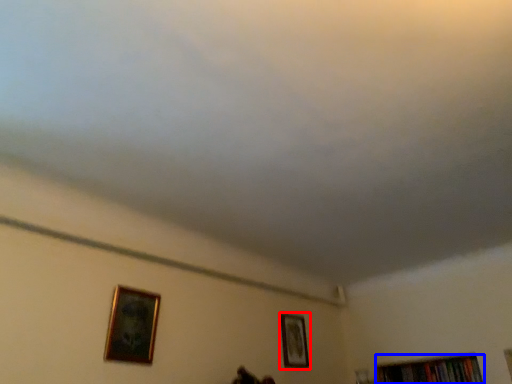
Question: Which object is further to the camera taking this photo, picture frame (highlighted by a red box) or book (highlighted by a blue box)?

Choices:
 (A) picture frame
 (B) book

Answer: (B)